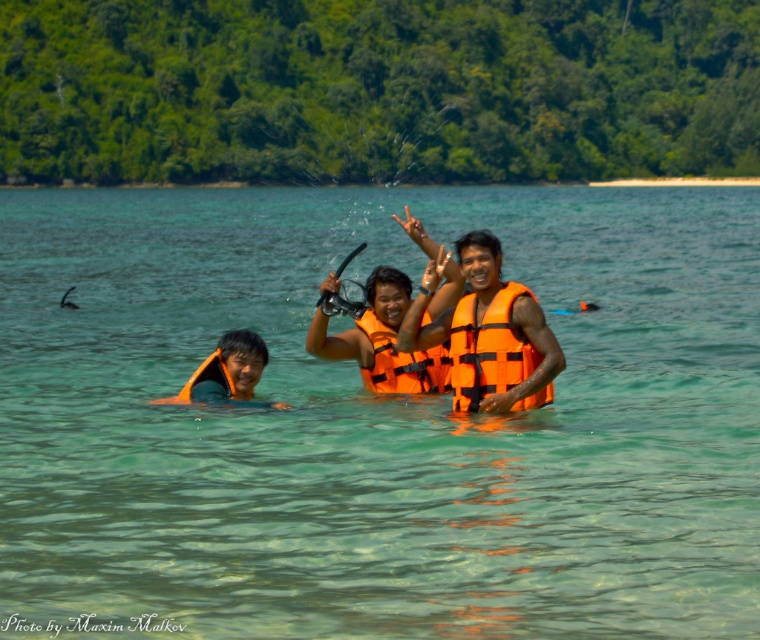
What do you see at coordinates (486, 348) in the screenshot? The height and width of the screenshot is (640, 760). I see `orange matte life jacket at center` at bounding box center [486, 348].

Looking at this image, who is more distant from viewer, (x=502, y=332) or (x=201, y=378)?

The point (x=201, y=378) is behind.

Where is `orange matte life jacket at center`? The image size is (760, 640). orange matte life jacket at center is located at coordinates (486, 348).

Is point (375, 550) positioned in front of point (488, 314)?

That is True.

Can you confirm if clear water at center is positioned below orange life vest at center?

Incorrect, clear water at center is not positioned below orange life vest at center.

Is point (184, 577) farther from viewer compared to point (524, 394)?

No, (184, 577) is in front of (524, 394).

Find the location of a particular element. This screenshot has height=640, width=760. clear water at center is located at coordinates (375, 420).

Is clear water at center bigger than orange life vest at left?

Correct, clear water at center is larger in size than orange life vest at left.

Does clear water at center have a lesser height compared to orange life vest at left?

Incorrect, clear water at center's height does not fall short of orange life vest at left's.

This screenshot has width=760, height=640. I want to click on clear water at center, so click(375, 420).